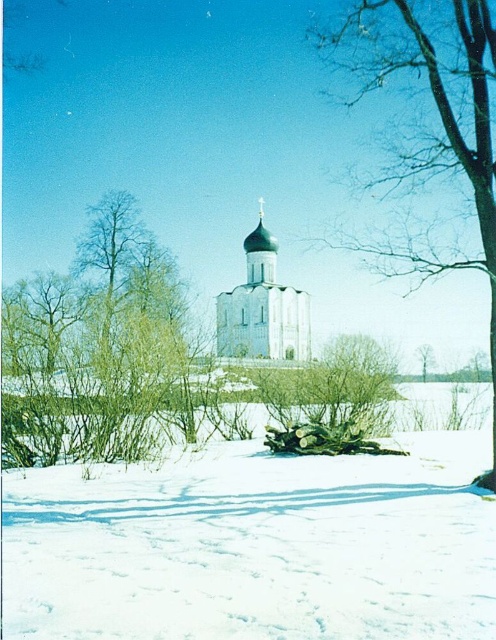
Does white powdery snow at lower center have a lesser height compared to bare wood at center?

Correct, white powdery snow at lower center is not as tall as bare wood at center.

Can you confirm if white powdery snow at lower center is positioned above bare wood at center?

No.

Does point (468, 433) come in front of point (425, 3)?

No, (468, 433) is behind (425, 3).

Locate an element on the screen. The height and width of the screenshot is (640, 496). white powdery snow at lower center is located at coordinates (255, 547).

Between green leafy shrub at left and bare wood at center, which one appears on the right side from the viewer's perspective?

From the viewer's perspective, bare wood at center appears more on the right side.

The image size is (496, 640). What do you see at coordinates (98, 349) in the screenshot?
I see `green leafy shrub at left` at bounding box center [98, 349].

You are a GUI agent. You are given a task and a screenshot of the screen. Output one action in this format:
    pyautogui.click(x=<x>, y=<y>)
    Task: Click on the green leafy shrub at left
    The height and width of the screenshot is (640, 496).
    Given the screenshot: What is the action you would take?
    pyautogui.click(x=98, y=349)

Measure the distance from white powdery snow at lower center to white stone church at center.

145.75 feet

I want to click on white powdery snow at lower center, so (255, 547).

Based on the photo, who is more forward, (390, 538) or (308, 340)?

Point (390, 538)

At what (x,y) coordinates should I click in order to perform the action: click on white powdery snow at lower center. Please return your answer as a coordinate pair (x, y). The width and height of the screenshot is (496, 640). Looking at the image, I should click on (255, 547).